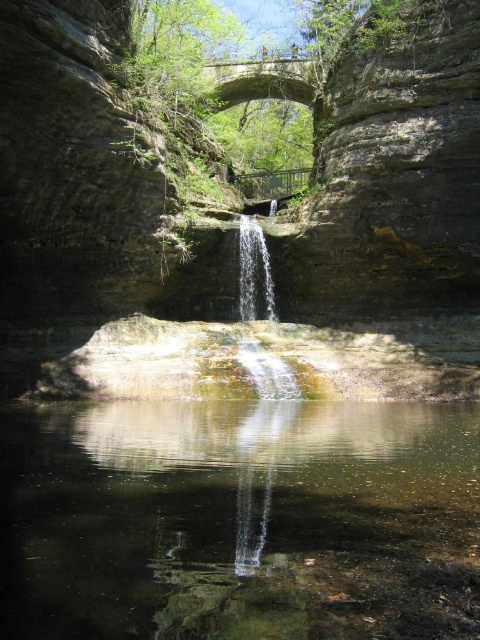
Is point (135, 289) positioned behind point (388, 541)?

Yes.

From the picture: Who is more forward, (45, 243) or (305, 404)?

Point (305, 404)

Measure the distance between point (466,136) and camera.

The distance of point (466,136) from camera is 42.41 meters.

Image resolution: width=480 pixels, height=640 pixels. I want to click on smooth rock waterfall at center, so click(x=86, y=209).

Which is above, clear water at center or clear glass waterfall at center?

clear glass waterfall at center is higher up.

Can you confirm if clear water at center is taller than clear glass waterfall at center?

In fact, clear water at center may be shorter than clear glass waterfall at center.

At what (x,y) coordinates should I click in order to perform the action: click on clear water at center. Please return your answer as a coordinate pair (x, y). The image size is (480, 640). Looking at the image, I should click on (240, 520).

Identify the location of clear water at center. (240, 520).

Between point (86, 134) and point (268, 467), which one is positioned in front?

Point (268, 467) is more forward.

Identify the location of smooth rock waterfall at center. (86, 209).

Find the location of a particular element. smooth rock waterfall at center is located at coordinates (86, 209).